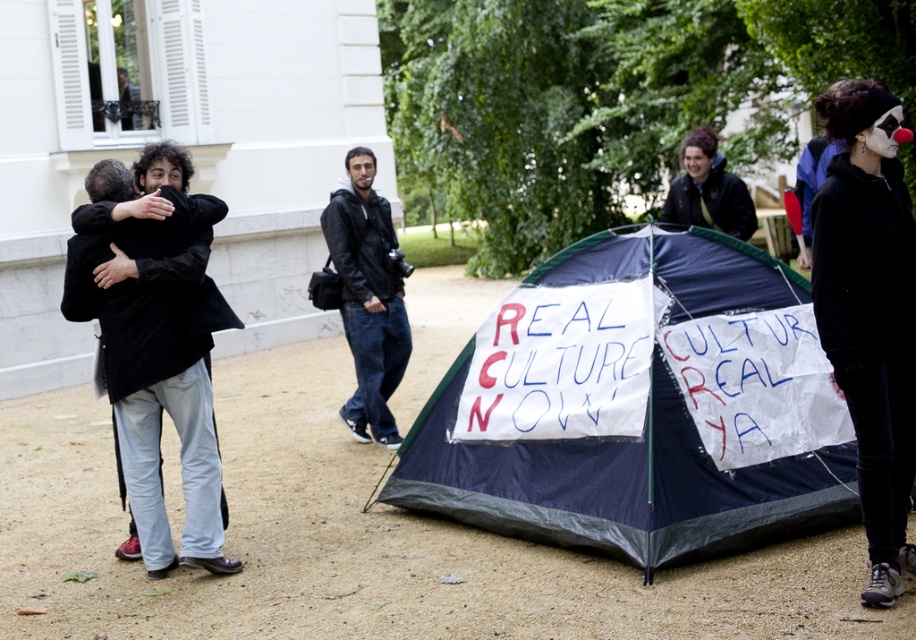
You are planning to set up a temporary shelter in the park. Given the space available, can the dark blue tarpaulin tent at center fit alongside the matte black jacket at upper center without overlapping?

The dark blue tarpaulin tent at center might be wider than matte black jacket at upper center, so there could be a risk of overlapping if placed side by side. Ensure there is sufficient space to accommodate the tent.

You are a photographer standing in the park and want to take a photo of the dark blue tarpaulin tent at center and the black coat at left. Based on their heights, which object should you focus on first to ensure both are in frame?

The dark blue tarpaulin tent at center has a lesser height compared to the black coat at left, so you should focus on the taller black coat at left first to ensure both are in frame.

You are a photographer trying to capture a photo of the dark blue tarpaulin tent at center and the matte black jacket at upper center. Which object should you focus on first if you want to ensure both are in focus without adjusting the camera settings?

The dark blue tarpaulin tent at center is taller than the matte black jacket at upper center, so you should focus on the taller object first to ensure both are in focus.